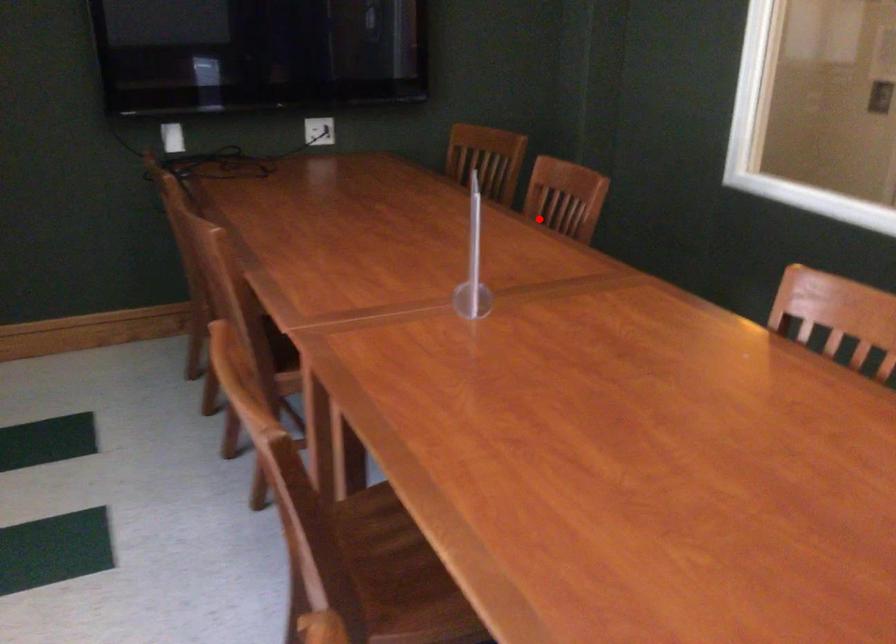
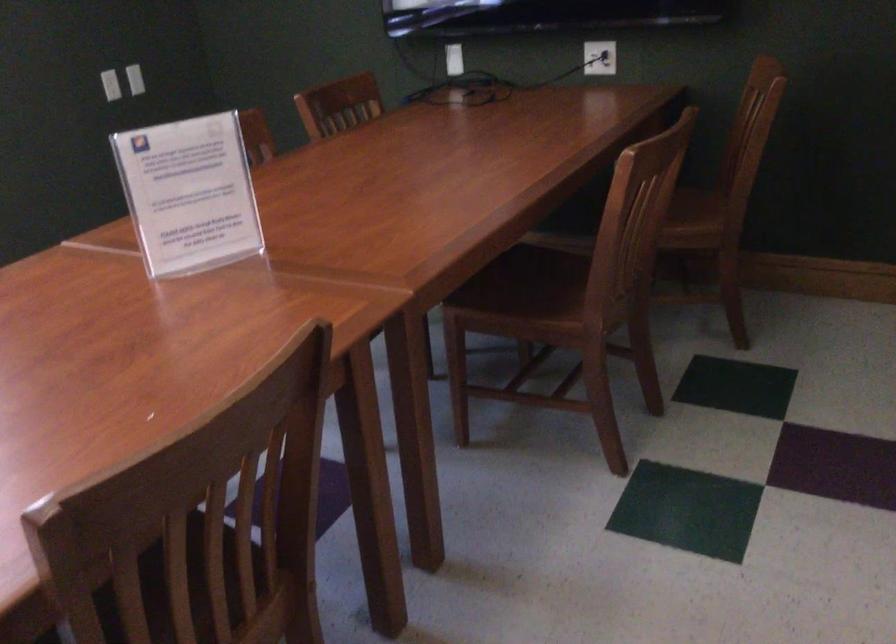
Question: I am providing you with two images of the same scene from different viewpoints. In image1, a red point is highlighted. Considering the same 3D point in image2, which of the following is correct?

Choices:
 (A) It is closer
 (B) It is farther

Answer: (A)